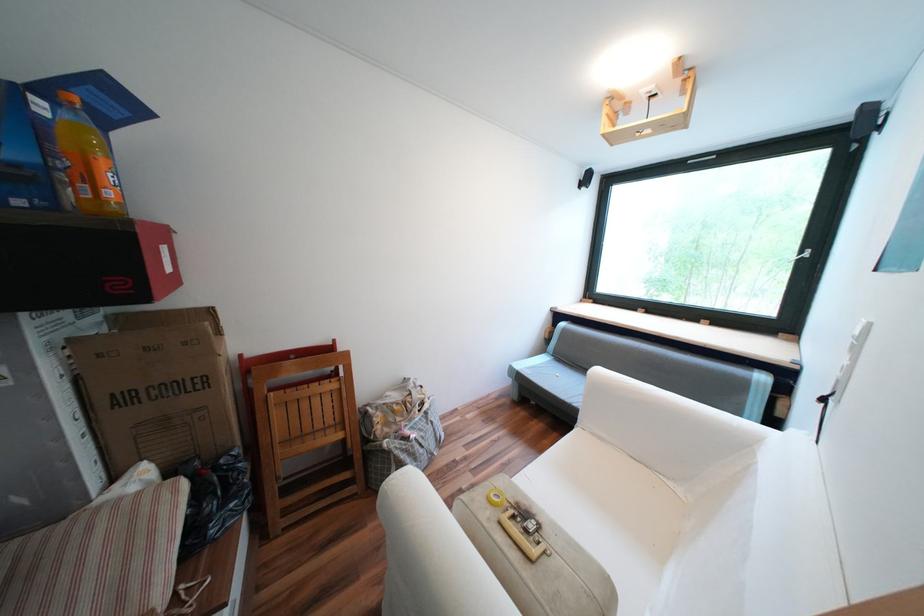
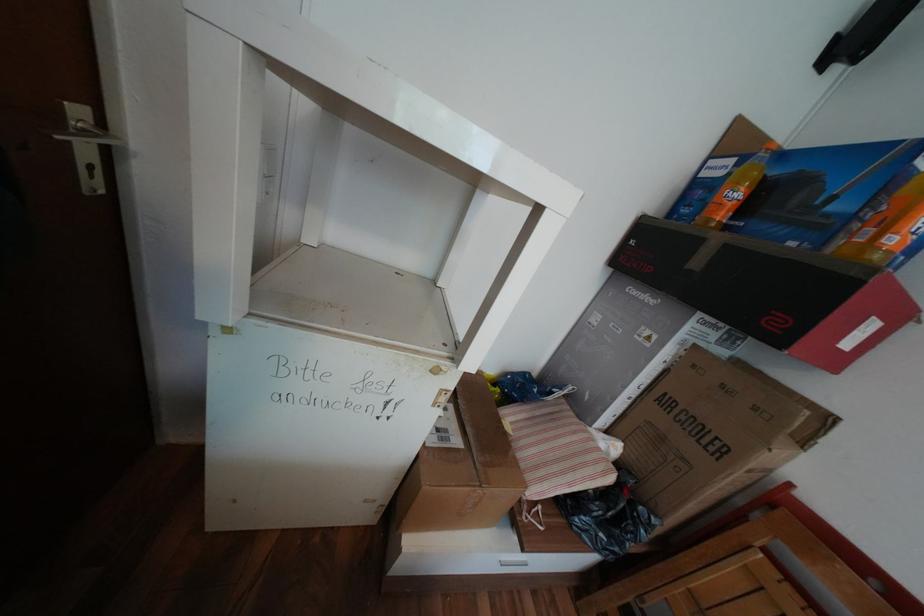
First-person continuous shooting, in which direction is the camera rotating?

The camera rotated toward left-down.